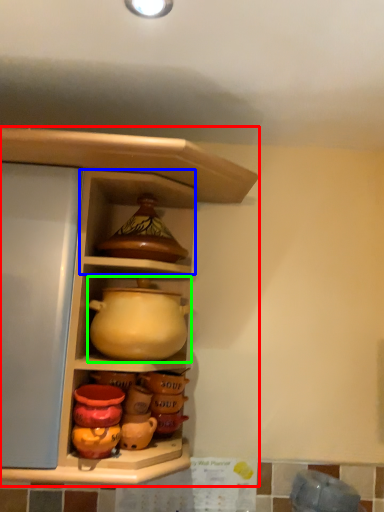
Question: Which object is positioned farthest from shelf (highlighted by a red box)? Select from cabinet (highlighted by a blue box) and jug (highlighted by a green box).

Choices:
 (A) cabinet
 (B) jug

Answer: (B)